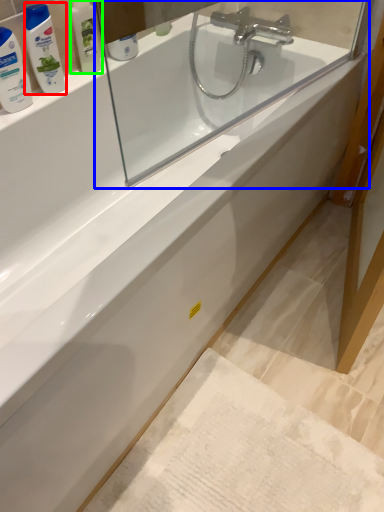
Question: Which is nearer to the mouthwash (highlighted by a red box)? mirror (highlighted by a blue box) or toiletry (highlighted by a green box).

Choices:
 (A) mirror
 (B) toiletry

Answer: (B)